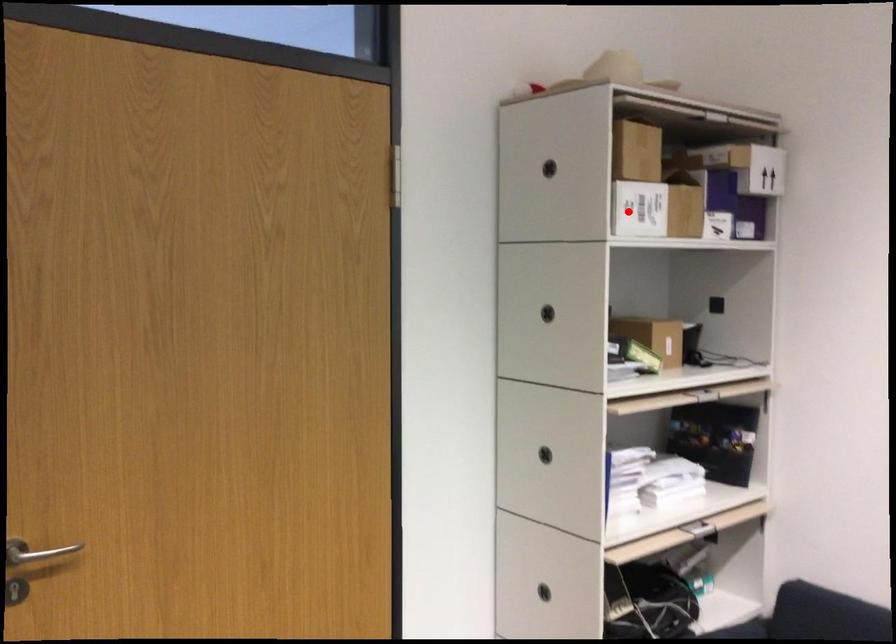
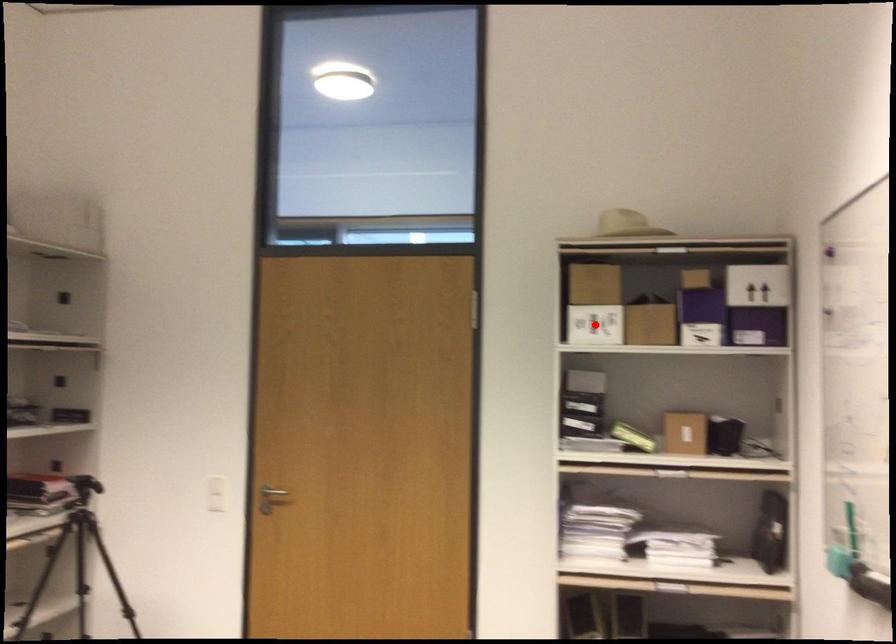
I am providing you with two images of the same scene from different viewpoints. A red point is marked on the first image and another point is marked on the second image. Is the red point in image1 aligned with the point shown in image2?

Yes